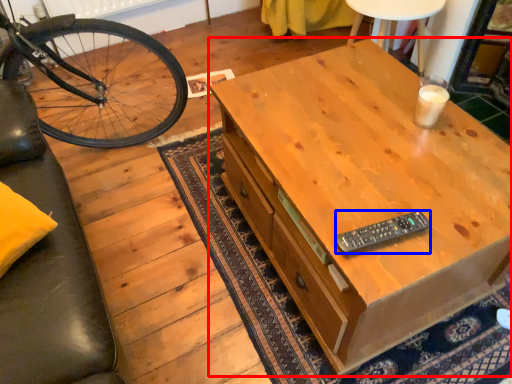
Question: Which of the following is the farthest to the observer, desk (highlighted by a red box) or remote control (highlighted by a blue box)?

Choices:
 (A) desk
 (B) remote control

Answer: (B)